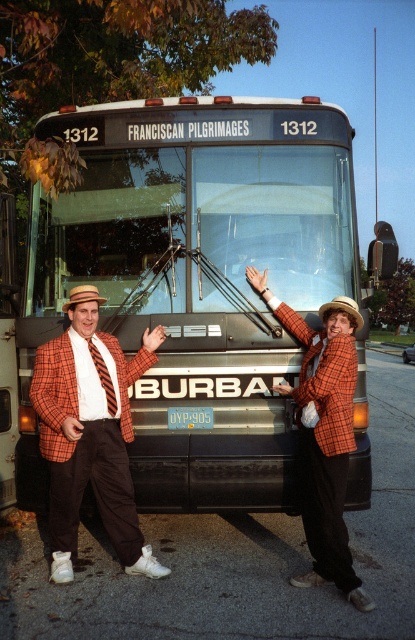
Can you confirm if metallic silver bus at center is smaller than plaid wool blazer at center?

Incorrect, metallic silver bus at center is not smaller in size than plaid wool blazer at center.

Between point (163, 168) and point (339, 372), which one is positioned in front?

Positioned in front is point (339, 372).

The image size is (415, 640). I want to click on metallic silver bus at center, so click(x=193, y=280).

In the scene shown: Can you confirm if orange checkered blazer at center is positioned to the right of plaid wool blazer at center?

No, orange checkered blazer at center is not to the right of plaid wool blazer at center.

Locate an element on the screen. Image resolution: width=415 pixels, height=640 pixels. orange checkered blazer at center is located at coordinates (90, 433).

Which is in front, point (182, 198) or point (322, 310)?

Point (322, 310) is more forward.

Is point (222, 163) positioned before point (361, 316)?

No.

Find the location of a particular element. metallic silver bus at center is located at coordinates (193, 280).